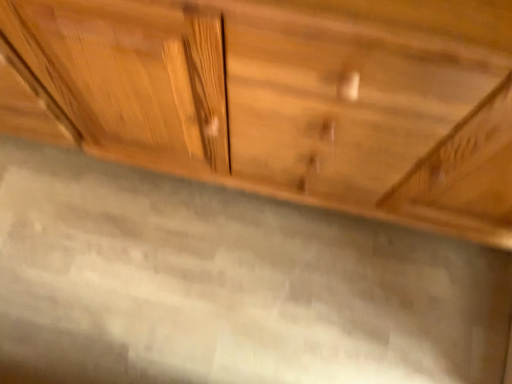
Where is `vacant region above gray polished granite at center (from a real-world perspective)`? The height and width of the screenshot is (384, 512). vacant region above gray polished granite at center (from a real-world perspective) is located at coordinates (225, 283).